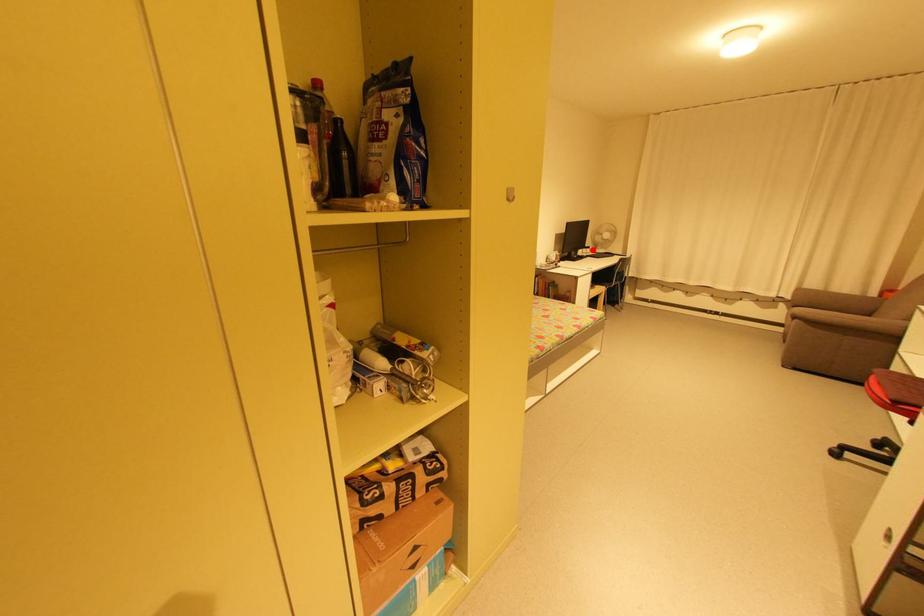
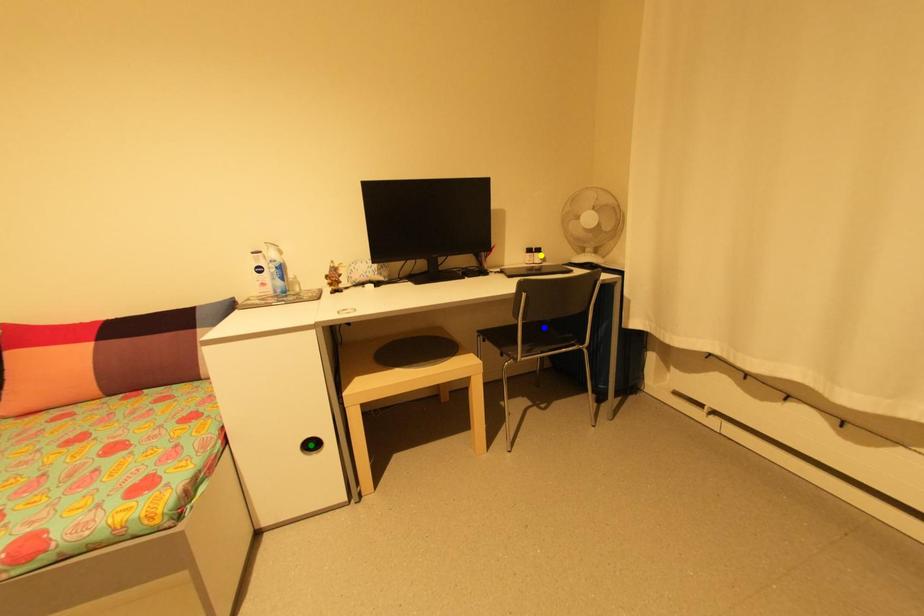
Question: I am providing you with two images of the same scene from different viewpoints. A red point is marked on the first image. You are given multiple points on the second image. Which mark in image 2 goes with the point in image 1?

Choices:
 (A) blue point
 (B) yellow point
 (C) green point

Answer: (B)